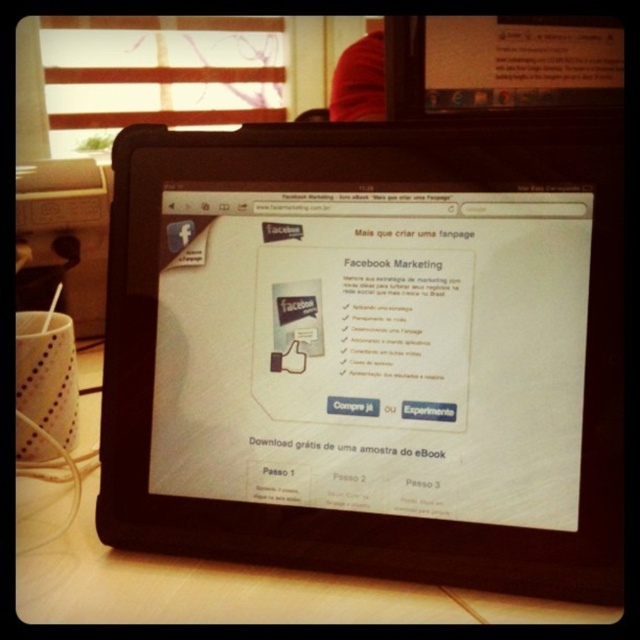
Question: Can you confirm if black matte tablet at center is positioned to the right of wooden table at lower center?

Choices:
 (A) yes
 (B) no

Answer: (A)

Question: Which object is closer to the camera taking this photo?

Choices:
 (A) wooden table at lower center
 (B) black matte tablet at center

Answer: (A)

Question: Is black matte tablet at center wider than wooden table at lower center?

Choices:
 (A) yes
 (B) no

Answer: (B)

Question: Does black matte tablet at center have a lesser width compared to wooden table at lower center?

Choices:
 (A) yes
 (B) no

Answer: (A)

Question: Among these points, which one is nearest to the camera?

Choices:
 (A) pos(332,614)
 (B) pos(160,387)

Answer: (A)

Question: Which point appears closest to the camera in this image?

Choices:
 (A) (432, 554)
 (B) (44, 588)

Answer: (B)